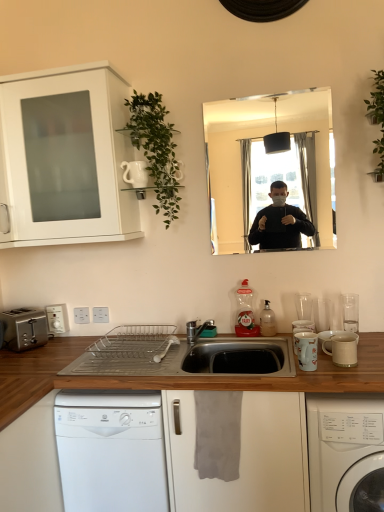
Question: Considering the positions of wooden at lower center, the second countertop viewed from the top, and white glossy washing machine at lower right in the image, is wooden at lower center, the second countertop viewed from the top, taller or shorter than white glossy washing machine at lower right?

Choices:
 (A) short
 (B) tall

Answer: (B)

Question: Considering their positions, is wooden at lower center, the second countertop viewed from the top, located in front of or behind white glossy washing machine at lower right?

Choices:
 (A) behind
 (B) front

Answer: (A)

Question: Estimate the real-world distances between objects in this image. Which object is farther from the wooden countertop at center, the 2th countertop ordered from the bottom?

Choices:
 (A) white ceramic mug at right, which is counted as the first appliance, starting from the bottom
 (B) wooden at lower center, the second countertop viewed from the top
 (C) white plastic dishwasher at lower center
 (D) translucent plastic bottle at sink, the second bottle when ordered from right to left
 (E) white glossy mug at right, arranged as the second appliance when viewed from the top

Answer: (D)

Question: Based on their relative distances, which object is nearer to the white glossy cabinet at upper left?

Choices:
 (A) silver metallic toaster at lower left
 (B) white ceramic mug at right, acting as the 2th appliance starting from the back
 (C) white glossy washing machine at lower right
 (D) wooden countertop at center, arranged as the 1th countertop when viewed from the top
 (E) translucent plastic bottle at sink, the second bottle when ordered from right to left

Answer: (A)